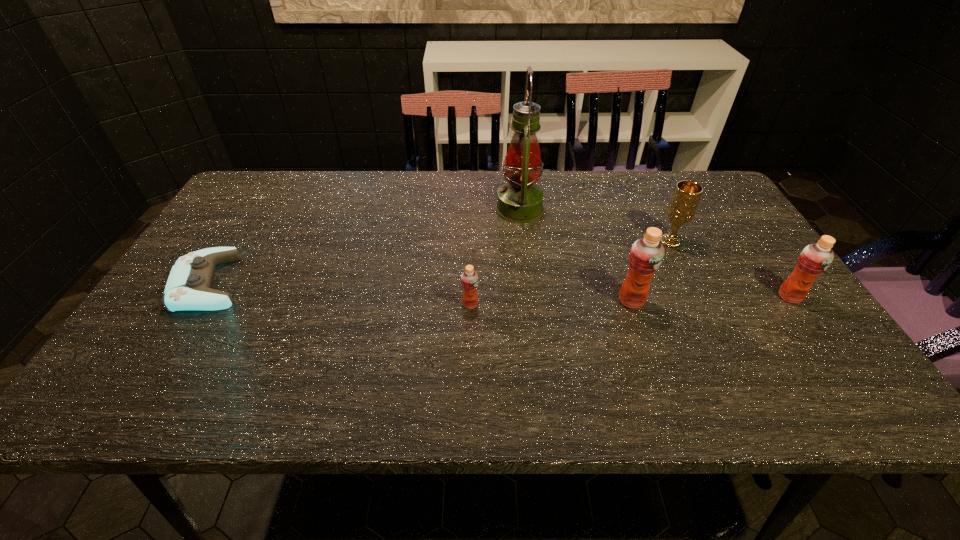
Where is `the shortest orange juice`? The height and width of the screenshot is (540, 960). the shortest orange juice is located at coordinates (469, 279).

Locate an element on the screen. The image size is (960, 540). the second object from left to right is located at coordinates (469, 279).

The height and width of the screenshot is (540, 960). I want to click on the second orange juice from left to right, so click(x=646, y=255).

Locate an element on the screen. The image size is (960, 540). the rightmost object is located at coordinates (815, 258).

This screenshot has height=540, width=960. Find the location of `the rightmost orange juice`. the rightmost orange juice is located at coordinates (815, 258).

Locate an element on the screen. This screenshot has width=960, height=540. oil lamp is located at coordinates (520, 201).

Find the location of `the farthest object`. the farthest object is located at coordinates (520, 201).

Locate an element on the screen. This screenshot has width=960, height=540. the shortest object is located at coordinates (188, 287).

This screenshot has width=960, height=540. Identify the location of control. (188, 287).

This screenshot has height=540, width=960. Identify the location of the second farthest object. (682, 207).